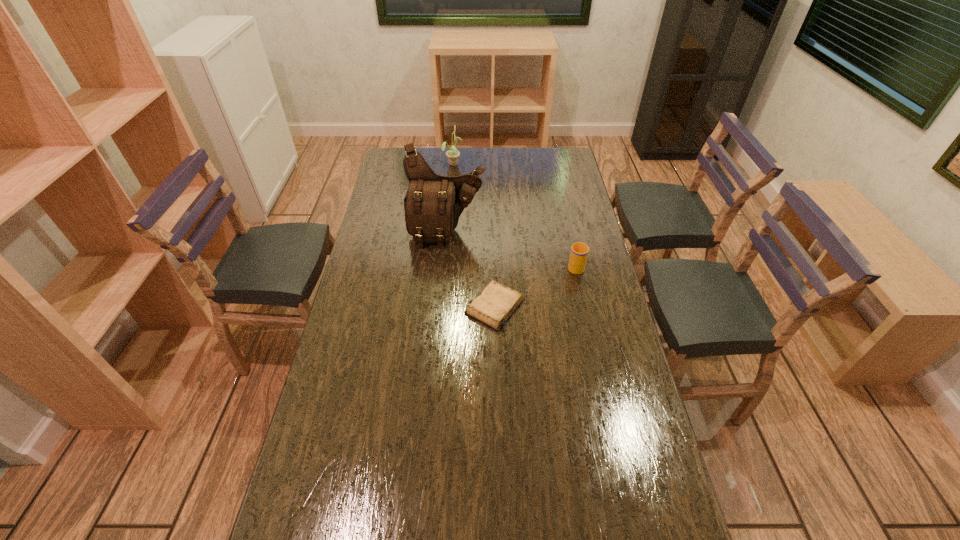
Locate an element on the screen. shoulder bag is located at coordinates (433, 204).

This screenshot has width=960, height=540. Identify the location of the second farthest object. (433, 204).

I want to click on the farthest object, so click(x=453, y=154).

Identify the location of sunflower. (453, 154).

The image size is (960, 540). Find the location of `the second nearest object`. the second nearest object is located at coordinates (579, 252).

The image size is (960, 540). Find the location of `the rightmost object`. the rightmost object is located at coordinates (579, 252).

You are a GUI agent. You are given a task and a screenshot of the screen. Output one action in this format:
    pyautogui.click(x=<x>, y=<y>)
    Task: Click on the diary
    The height and width of the screenshot is (540, 960).
    Given the screenshot: What is the action you would take?
    pyautogui.click(x=496, y=303)

Locate an element on the screen. the nearest object is located at coordinates (496, 303).

Find the location of a particular element. blank space located 0.230m on the front-facing side of the shoulder bag is located at coordinates (442, 294).

You are a GUI agent. You are given a task and a screenshot of the screen. Output one action in this format:
    pyautogui.click(x=<x>, y=<y>)
    Task: Click on the free space located 0.160m on the front-facing side of the third shortest object
    
    Given the screenshot: What is the action you would take?
    pyautogui.click(x=496, y=163)